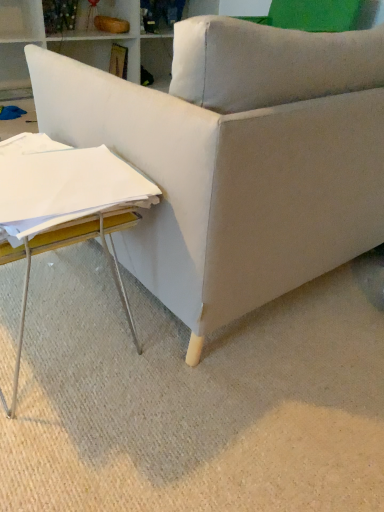
Question: Does white paper at lower left turn towards beige fabric couch at lower right?

Choices:
 (A) yes
 (B) no

Answer: (B)

Question: Is white paper at lower left bigger than beige fabric couch at lower right?

Choices:
 (A) yes
 (B) no

Answer: (B)

Question: Is white paper at lower left outside beige fabric couch at lower right?

Choices:
 (A) no
 (B) yes

Answer: (B)

Question: Is white paper at lower left in front of beige fabric couch at lower right?

Choices:
 (A) no
 (B) yes

Answer: (A)

Question: Would you say white paper at lower left is a long distance from beige fabric couch at lower right?

Choices:
 (A) no
 (B) yes

Answer: (A)

Question: Is white paper at lower left wider than beige fabric couch at lower right?

Choices:
 (A) no
 (B) yes

Answer: (A)

Question: Is beige fabric couch at lower right thinner than white wood table at lower left?

Choices:
 (A) yes
 (B) no

Answer: (B)

Question: Could white wood table at lower left be considered to be inside beige fabric couch at lower right?

Choices:
 (A) yes
 (B) no

Answer: (B)

Question: From a real-world perspective, does beige fabric couch at lower right stand above white wood table at lower left?

Choices:
 (A) no
 (B) yes

Answer: (A)

Question: From a real-world perspective, does beige fabric couch at lower right sit lower than white wood table at lower left?

Choices:
 (A) no
 (B) yes

Answer: (B)

Question: Can you confirm if beige fabric couch at lower right is shorter than white wood table at lower left?

Choices:
 (A) no
 (B) yes

Answer: (B)

Question: Can you confirm if beige fabric couch at lower right is positioned to the left of white wood table at lower left?

Choices:
 (A) no
 (B) yes

Answer: (A)

Question: From the image's perspective, is white wood table at lower left beneath white paper at lower left?

Choices:
 (A) no
 (B) yes

Answer: (B)